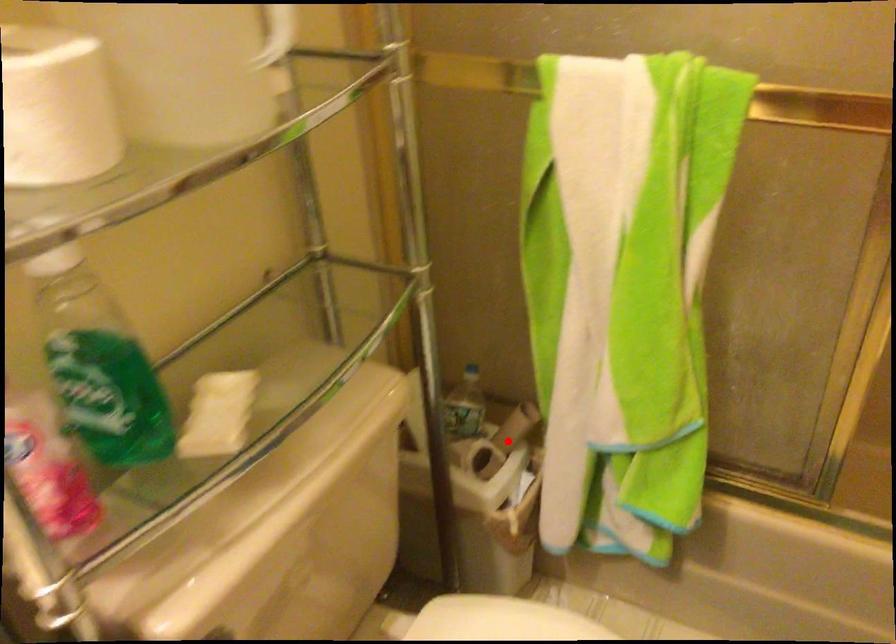
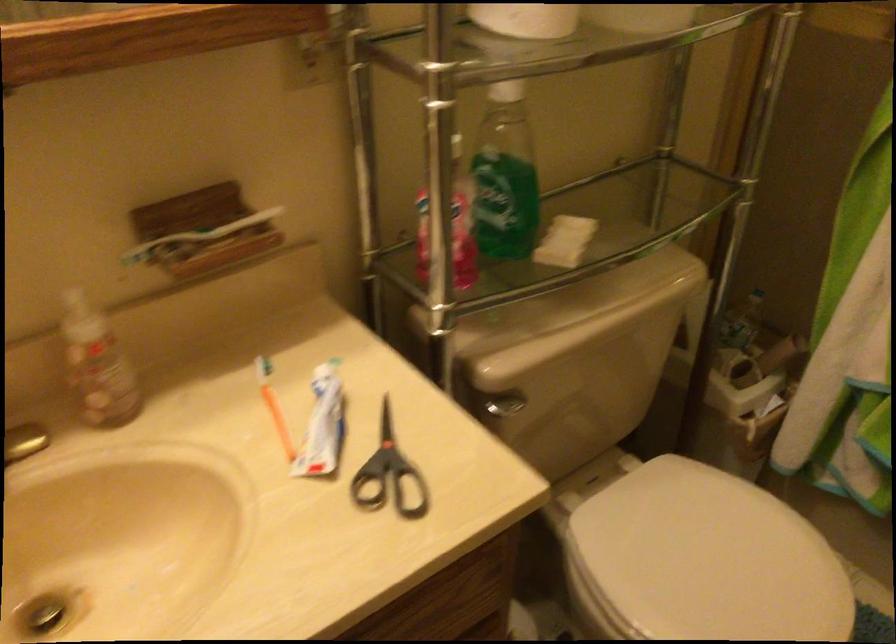
In the second image, find the point that corresponds to the highlighted location in the first image.

(764, 361)